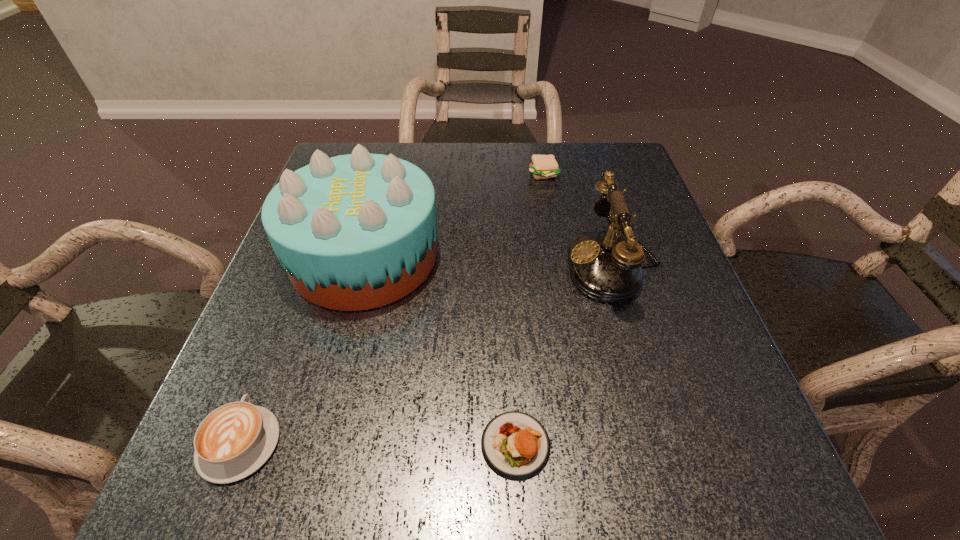
Identify the location of free region located on the dial of the telephone. (424, 264).

You are a GUI agent. You are given a task and a screenshot of the screen. Output one action in this format:
    pyautogui.click(x=<x>, y=<y>)
    Task: Click on the vacant space located 0.190m on the front of the right patty (food)
    The width and height of the screenshot is (960, 540).
    Given the screenshot: What is the action you would take?
    pyautogui.click(x=554, y=231)

You are a GUI agent. You are given a task and a screenshot of the screen. Output one action in this format:
    pyautogui.click(x=<x>, y=<y>)
    Task: Click on the vacant region located 0.240m on the side of the cappuccino with the handle
    This screenshot has height=540, width=960.
    Given the screenshot: What is the action you would take?
    pyautogui.click(x=298, y=292)

Identify the location of free region located on the side of the cappuccino with the handle. (292, 308).

Where is `vacant point located on the side of the cappuccino with the handle`? The image size is (960, 540). vacant point located on the side of the cappuccino with the handle is located at coordinates (293, 304).

Locate an element on the screen. The height and width of the screenshot is (540, 960). free space located 0.110m on the back of the third object from right to left is located at coordinates [511, 354].

Where is `object positioned at the far edge`? Image resolution: width=960 pixels, height=540 pixels. object positioned at the far edge is located at coordinates (542, 166).

The width and height of the screenshot is (960, 540). What are the coordinates of `cappuccino that is at the near edge` in the screenshot? It's located at (233, 441).

Identify the location of patty (food) that is positioned at the near edge. point(515,445).

Identify the location of cake present at the left edge. This screenshot has width=960, height=540. (354, 232).